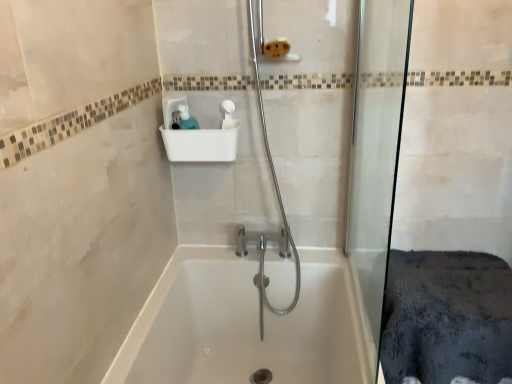
Question: From a real-world perspective, is transparent glass shower door at right physically below white glossy bathtub at center?

Choices:
 (A) yes
 (B) no

Answer: (B)

Question: Considering the relative sizes of transparent glass shower door at right and white glossy bathtub at center in the image provided, is transparent glass shower door at right smaller than white glossy bathtub at center?

Choices:
 (A) no
 (B) yes

Answer: (B)

Question: From the image's perspective, is transparent glass shower door at right below white glossy bathtub at center?

Choices:
 (A) yes
 (B) no

Answer: (B)

Question: Is transparent glass shower door at right further to camera compared to white glossy bathtub at center?

Choices:
 (A) yes
 (B) no

Answer: (B)

Question: From the image's perspective, is transparent glass shower door at right above white glossy bathtub at center?

Choices:
 (A) yes
 (B) no

Answer: (A)

Question: Is transparent glass shower door at right completely or partially outside of white glossy bathtub at center?

Choices:
 (A) yes
 (B) no

Answer: (A)

Question: Considering the relative positions of transparent glass shower door at right and white plastic sink at upper center in the image provided, is transparent glass shower door at right to the right of white plastic sink at upper center from the viewer's perspective?

Choices:
 (A) no
 (B) yes

Answer: (B)

Question: From a real-world perspective, is transparent glass shower door at right positioned over white plastic sink at upper center based on gravity?

Choices:
 (A) yes
 (B) no

Answer: (B)

Question: Can you confirm if transparent glass shower door at right is taller than white plastic sink at upper center?

Choices:
 (A) yes
 (B) no

Answer: (A)

Question: Does transparent glass shower door at right have a lesser height compared to white plastic sink at upper center?

Choices:
 (A) yes
 (B) no

Answer: (B)

Question: Does transparent glass shower door at right touch white plastic sink at upper center?

Choices:
 (A) no
 (B) yes

Answer: (A)

Question: Does transparent glass shower door at right have a lesser width compared to white plastic sink at upper center?

Choices:
 (A) no
 (B) yes

Answer: (B)

Question: Does white glossy bathtub at center have a lesser height compared to transparent glass shower door at right?

Choices:
 (A) yes
 (B) no

Answer: (A)